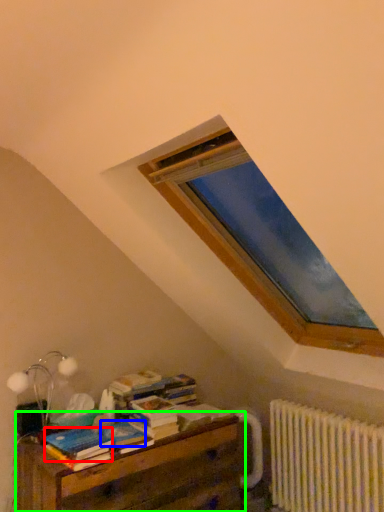
Question: Which object is positioned closest to paperback book (highlighted by a red box)? Select from paperback book (highlighted by a blue box) and nightstand (highlighted by a green box).

Choices:
 (A) paperback book
 (B) nightstand

Answer: (A)